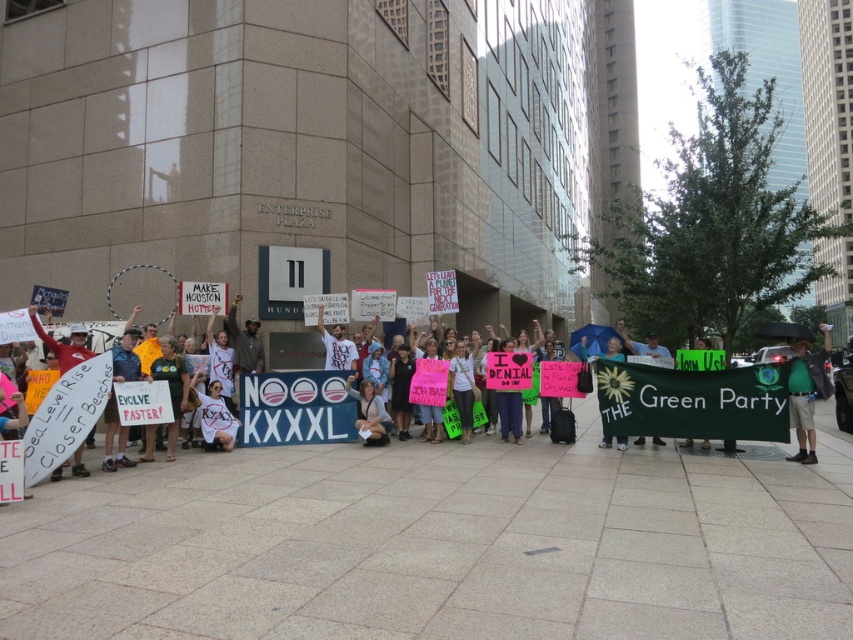
Does green fabric shirt at center appear over white paper sign at left?

Actually, green fabric shirt at center is below white paper sign at left.

Who is taller, green fabric shirt at center or white paper sign at left?

Standing taller between the two is green fabric shirt at center.

Measure the distance between green fabric shirt at center and camera.

green fabric shirt at center and camera are 32.36 feet apart from each other.

Locate an element on the screen. This screenshot has height=640, width=853. green fabric shirt at center is located at coordinates (807, 392).

Describe the element at coordinates (807, 392) in the screenshot. I see `green fabric shirt at center` at that location.

Can you confirm if green fabric shirt at center is wider than white cotton shirt at center?

Indeed, green fabric shirt at center has a greater width compared to white cotton shirt at center.

This screenshot has height=640, width=853. In order to click on green fabric shirt at center in this screenshot , I will do [807, 392].

Is white paper sign at left wider than white cotton shirt at center?

Indeed, white paper sign at left has a greater width compared to white cotton shirt at center.

Between white paper sign at left and white cotton shirt at center, which one is positioned lower?

Positioned lower is white cotton shirt at center.

Does point (45, 332) come in front of point (357, 358)?

Yes, it is.

The width and height of the screenshot is (853, 640). In order to click on white paper sign at left in this screenshot , I will do `click(62, 342)`.